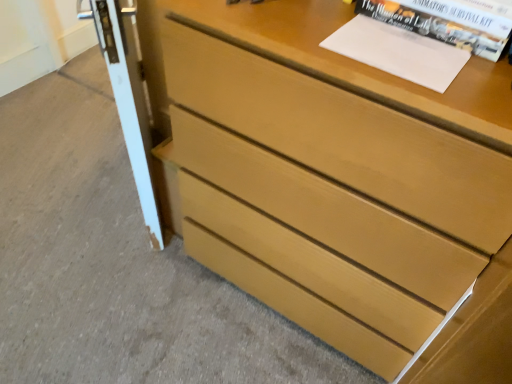
At what (x,y) coordinates should I click in order to perform the action: click on free region on the left part of light brown wood chest of drawers at center. Please return your answer as a coordinate pair (x, y). Image resolution: width=512 pixels, height=384 pixels. Looking at the image, I should click on (133, 288).